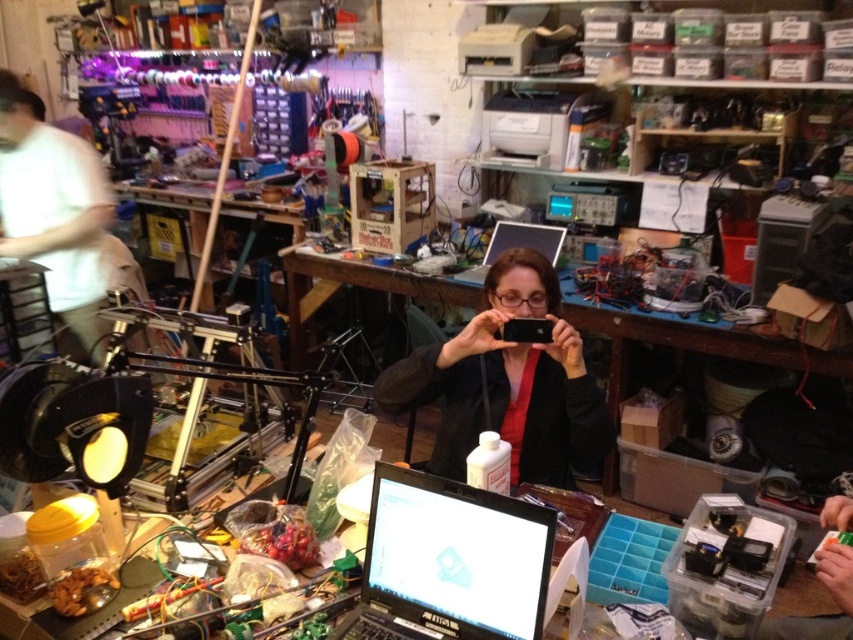
You are organizing the workshop and need to move the black glossy laptop at center to a higher shelf. However, you notice the wooden table at center is in the way. Can you lift the laptop without moving the table first?

The black glossy laptop at center is positioned under the wooden table at center, so you cannot lift the laptop without moving the table first.